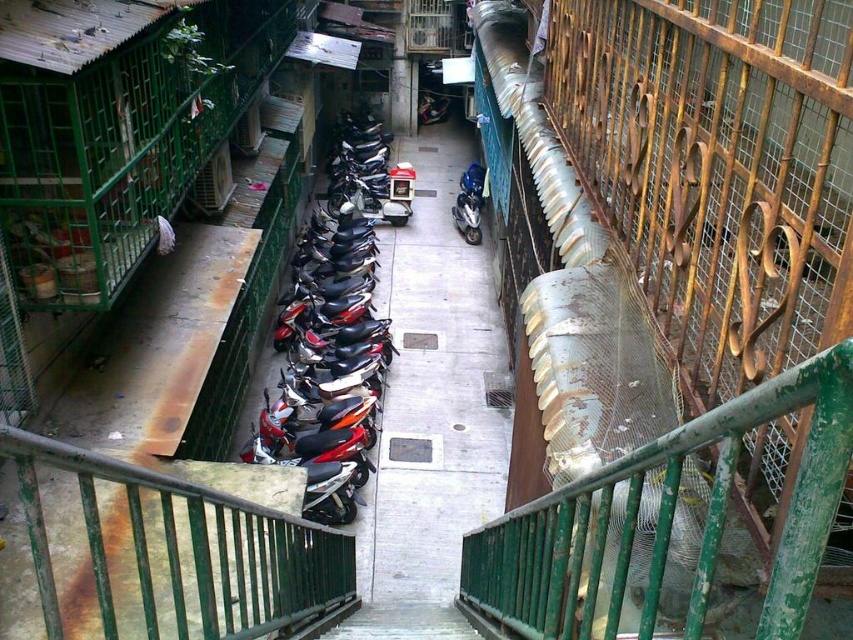
You are a delivery person trying to navigate through the narrow alleyway. You see a shiny metallic motorcycle at center and a blue metallic motorcycle at center. Which motorcycle should you avoid to ensure you can pass through the alley safely?

The shiny metallic motorcycle at center might be wider than blue metallic motorcycle at center, so it is safer to avoid the shiny metallic motorcycle at center to ensure you can pass through the alley safely.

You are a delivery person with a 2.5 meter long cart. You need to navigate your cart through the alley and pass between the green painted metal railing at upper right and the blue metallic motorcycle at center. Can your cart fit through the space between them?

The distance between the green painted metal railing at upper right and the blue metallic motorcycle at center is 20.34 meters. Since your cart is only 2.5 meters long, it can easily fit through the space between them as the distance is much larger than the cart.